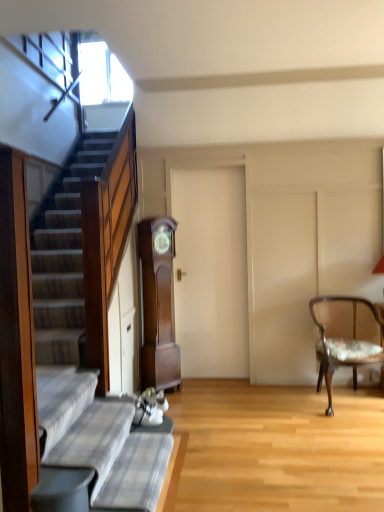
Where is `vacant area that lies to the right of brown wood grandfather clock at center`? vacant area that lies to the right of brown wood grandfather clock at center is located at coordinates (189, 393).